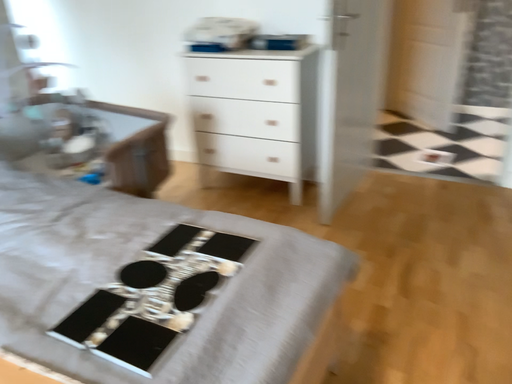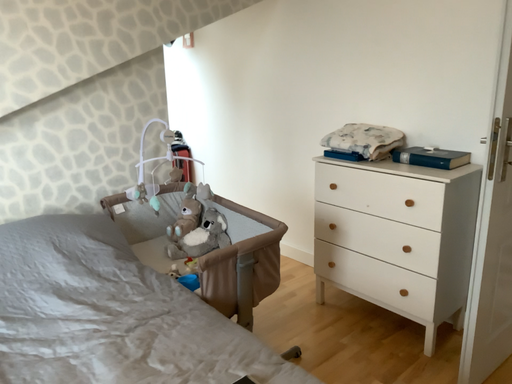
Question: How did the camera likely rotate when shooting the video?

Choices:
 (A) rotated upward
 (B) rotated downward

Answer: (A)